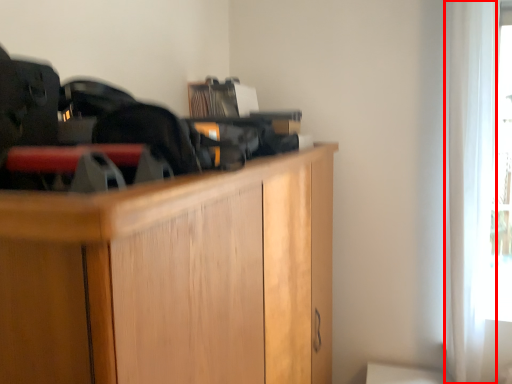
Question: From the image's perspective, where is curtain (annotated by the red box) located in relation to cabinetry in the image?

Choices:
 (A) below
 (B) above

Answer: (B)